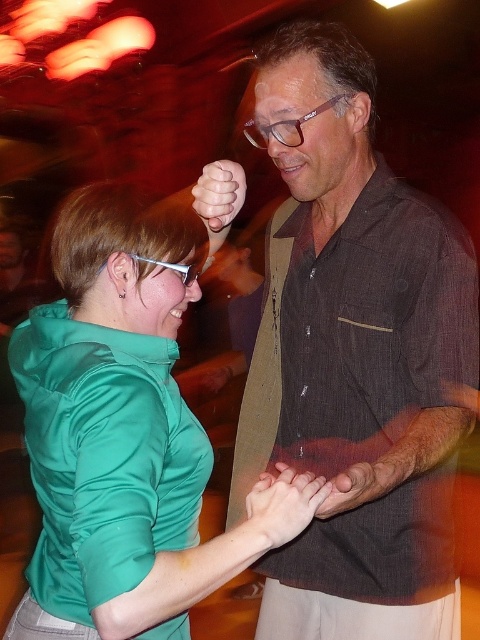
Between brown textured shirt at center and smooth skin hand at center, which one has more height?

brown textured shirt at center

Can you confirm if brown textured shirt at center is taller than smooth skin hand at center?

Yes.

What do you see at coordinates (357, 362) in the screenshot?
I see `brown textured shirt at center` at bounding box center [357, 362].

Find the location of a particular element. The image size is (480, 640). brown textured shirt at center is located at coordinates [357, 362].

Who is lower down, smooth skin hand at center or matte skin hand at center?

smooth skin hand at center is lower down.

Is smooth skin hand at center bigger than matte skin hand at center?

Actually, smooth skin hand at center might be smaller than matte skin hand at center.

This screenshot has height=640, width=480. I want to click on smooth skin hand at center, so click(x=278, y=508).

Is brown textured shirt at center in front of transparent plastic glasses at center?

Yes.

Between point (288, 636) and point (245, 131), which one is positioned in front?

Positioned in front is point (245, 131).

Locate an element on the screen. brown textured shirt at center is located at coordinates (357, 362).